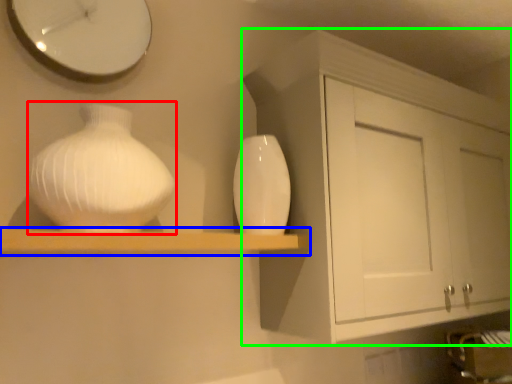
Question: Based on their relative distances, which object is farther from vase (highlighted by a red box)? Choose from shelf (highlighted by a blue box) and cabinetry (highlighted by a green box).

Choices:
 (A) shelf
 (B) cabinetry

Answer: (B)